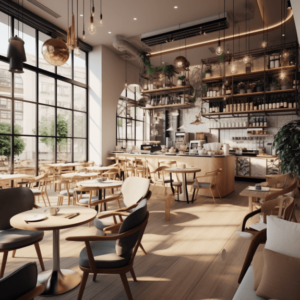
Locate an element on the screen. The image size is (300, 300). puck lights in ceiling is located at coordinates (80, 14), (110, 33), (136, 19), (175, 8), (120, 96).